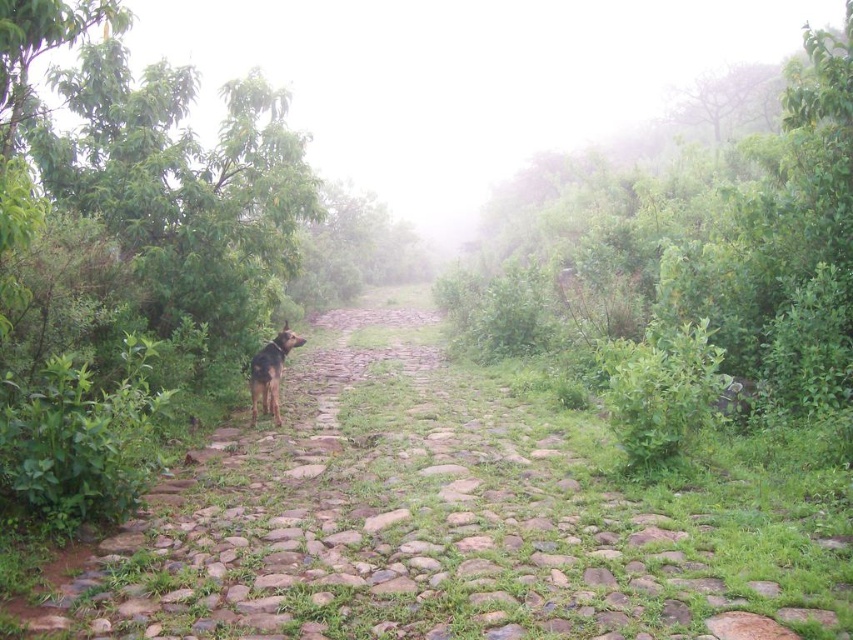
Question: Is green grassy trail at center in front of brown fur dog at left?

Choices:
 (A) no
 (B) yes

Answer: (B)

Question: Where is green grassy trail at center located in relation to brown fur dog at left in the image?

Choices:
 (A) left
 (B) right

Answer: (B)

Question: Which object appears farthest from the camera in this image?

Choices:
 (A) green grassy trail at center
 (B) brown fur dog at left

Answer: (B)

Question: Which point is farther to the camera?

Choices:
 (A) (485, 413)
 (B) (252, 358)

Answer: (A)

Question: Can you confirm if green grassy trail at center is positioned to the left of brown fur dog at left?

Choices:
 (A) yes
 (B) no

Answer: (B)